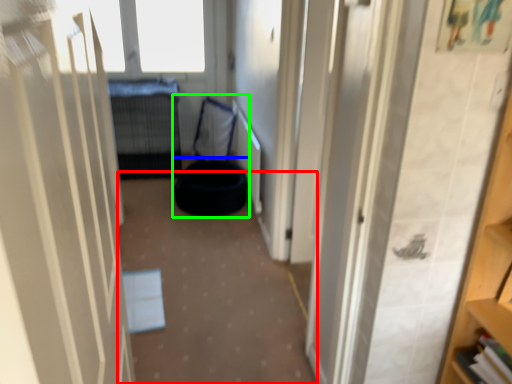
Question: Which object is the farthest from corridor (highlighted by a red box)? Choose among these: bean bag chair (highlighted by a blue box) or bean bag chair (highlighted by a green box).

Choices:
 (A) bean bag chair
 (B) bean bag chair

Answer: (B)